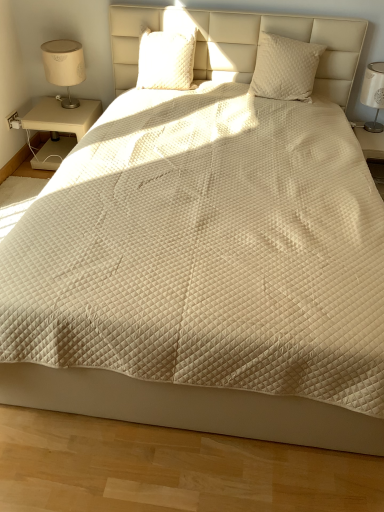
Question: Is white quilted fabric at right situated inside quilted cream pillow at upper center, placed as the 1th pillow when sorted from left to right, or outside?

Choices:
 (A) inside
 (B) outside

Answer: (B)

Question: Considering the positions of white quilted fabric at right and quilted cream pillow at upper center, placed as the 1th pillow when sorted from left to right, in the image, is white quilted fabric at right taller or shorter than quilted cream pillow at upper center, placed as the 1th pillow when sorted from left to right,?

Choices:
 (A) tall
 (B) short

Answer: (A)

Question: Based on their relative distances, which object is farther from the beige wood nightstand at left?

Choices:
 (A) white quilted pillow at upper right, which is counted as the 1th pillow, starting from the right
 (B) beige fabric lampshade at left
 (C) quilted cream pillow at upper center, the second pillow from the right
 (D) white fabric lampshade at right
 (E) white quilted fabric at right

Answer: (D)

Question: Which is farther from the white quilted pillow at upper right, which is counted as the 1th pillow, starting from the right?

Choices:
 (A) quilted cream pillow at upper center, the second pillow from the right
 (B) beige wood nightstand at left
 (C) beige fabric lampshade at left
 (D) white fabric lampshade at right
 (E) white quilted fabric at right

Answer: (C)